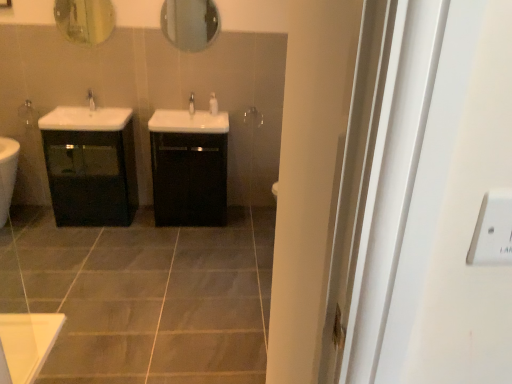
At what (x,y) coordinates should I click in order to perform the action: click on free space in front of matte black cabinet at left, the first bathroom cabinet positioned from the left. Please return your answer as a coordinate pair (x, y). Looking at the image, I should click on (74, 246).